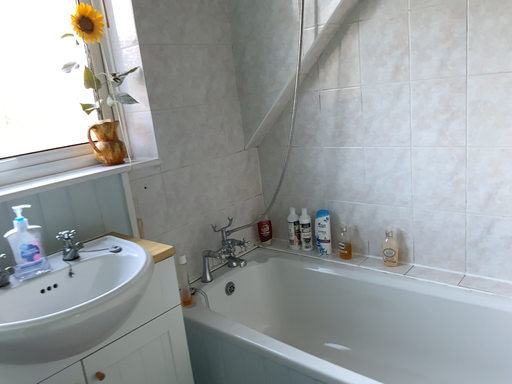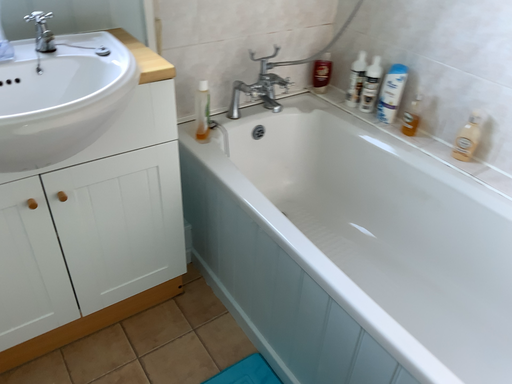
Question: Which way did the camera rotate in the video?

Choices:
 (A) rotated upward
 (B) rotated downward

Answer: (B)